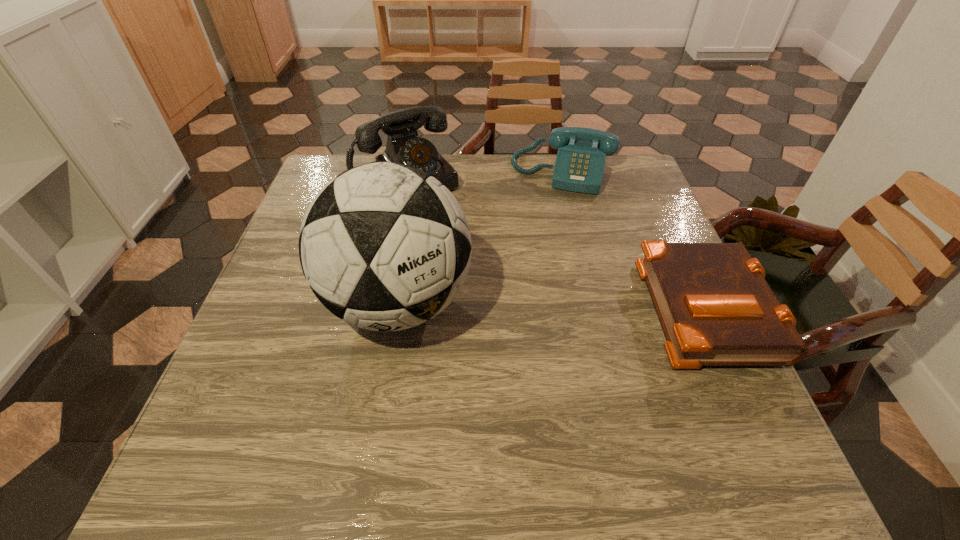
At what (x,y) coordinates should I click in order to perform the action: click on free spot at the near edge of the desktop. Please return your answer as a coordinate pair (x, y). Looking at the image, I should click on (630, 419).

Where is `free space at the left edge`? free space at the left edge is located at coordinates (321, 331).

Where is `vacant region at the right edge of the desktop`? The image size is (960, 540). vacant region at the right edge of the desktop is located at coordinates (671, 237).

Locate an element on the screen. Image resolution: width=960 pixels, height=540 pixels. free region at the far left corner of the desktop is located at coordinates (338, 173).

Where is `vacant area between the third tallest object and the shortest object`? This screenshot has width=960, height=540. vacant area between the third tallest object and the shortest object is located at coordinates (634, 240).

Where is `free spot between the second shortest object and the third shortest object`? This screenshot has width=960, height=540. free spot between the second shortest object and the third shortest object is located at coordinates (485, 177).

Locate an element on the screen. unoccupied position between the taller telephone and the shorter telephone is located at coordinates (485, 177).

At what (x,y) coordinates should I click in order to perform the action: click on free space between the shortest object and the second tallest object. Please return your answer as a coordinate pair (x, y). This screenshot has width=960, height=540. Looking at the image, I should click on (555, 244).

The width and height of the screenshot is (960, 540). I want to click on vacant space in between the left telephone and the shorter telephone, so click(x=485, y=177).

Where is `unoccupied position between the right telephone and the left telephone`? Image resolution: width=960 pixels, height=540 pixels. unoccupied position between the right telephone and the left telephone is located at coordinates (485, 177).